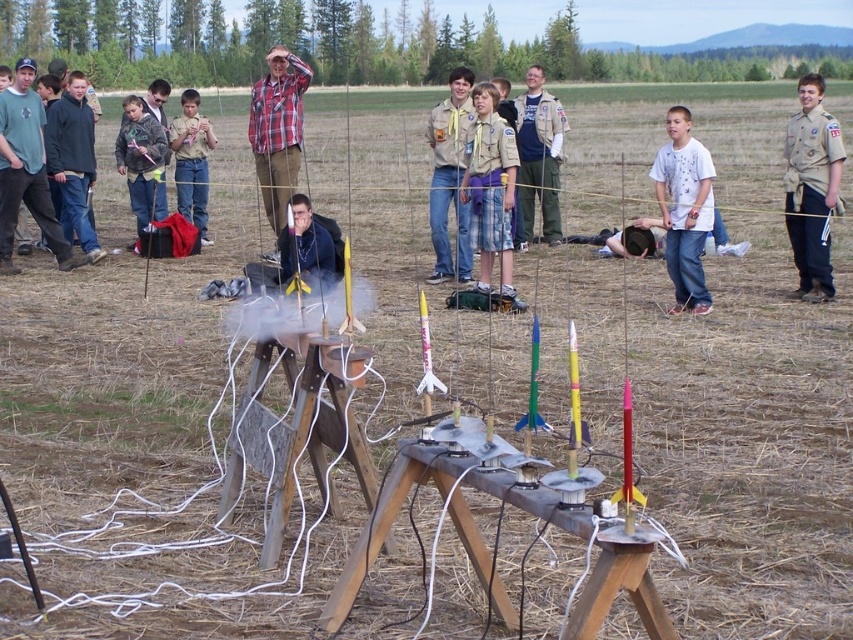
You are a photographer taking a picture of the khaki pants at center and the dark blue fleece jacket at left. Which object should you focus on first if you want to capture both in the frame without moving the camera?

The dark blue fleece jacket at left is positioned on the left side of khaki pants at center, so you should focus on the dark blue fleece jacket at left first to ensure both are in the frame without moving the camera.

You are a photographer standing at the edge of the field where the rocket launch is happening. You want to take a photo that includes both the rockets and the children launching them. The coordinates given are part of the scene. Is the point at coordinate point (x=683, y=209) part of the white cotton shirt at center?

Yes, the point at coordinate point (x=683, y=209) is part of the white cotton shirt at center as stated in the objects description.